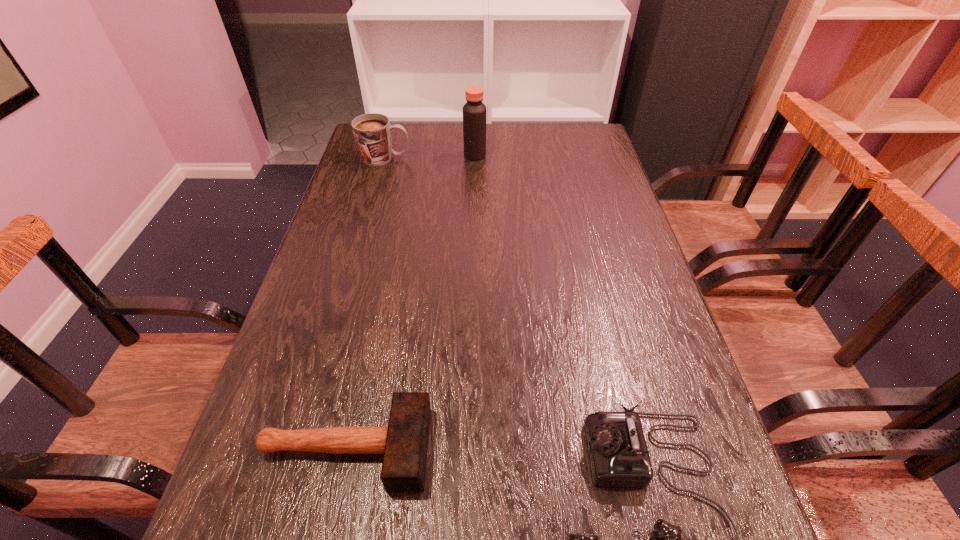
Identify the location of free space between the shortest object and the vinegar. Image resolution: width=960 pixels, height=540 pixels. (411, 302).

Point out which object is positioned as the nearest to the vinegar. Please provide its 2D coordinates. Your answer should be formatted as a tuple, i.e. [(x, y)], where the tuple contains the x and y coordinates of a point satisfying the conditions above.

[(372, 132)]

Locate which object ranks third in proximity to the third tallest object. Please provide its 2D coordinates. Your answer should be formatted as a tuple, i.e. [(x, y)], where the tuple contains the x and y coordinates of a point satisfying the conditions above.

[(372, 132)]

Where is `free location that satisfies the following two spatial constraints: 1. on the front side of the second object from right to left; 2. on the hammer head face of the mallet`? The width and height of the screenshot is (960, 540). free location that satisfies the following two spatial constraints: 1. on the front side of the second object from right to left; 2. on the hammer head face of the mallet is located at coordinates (470, 448).